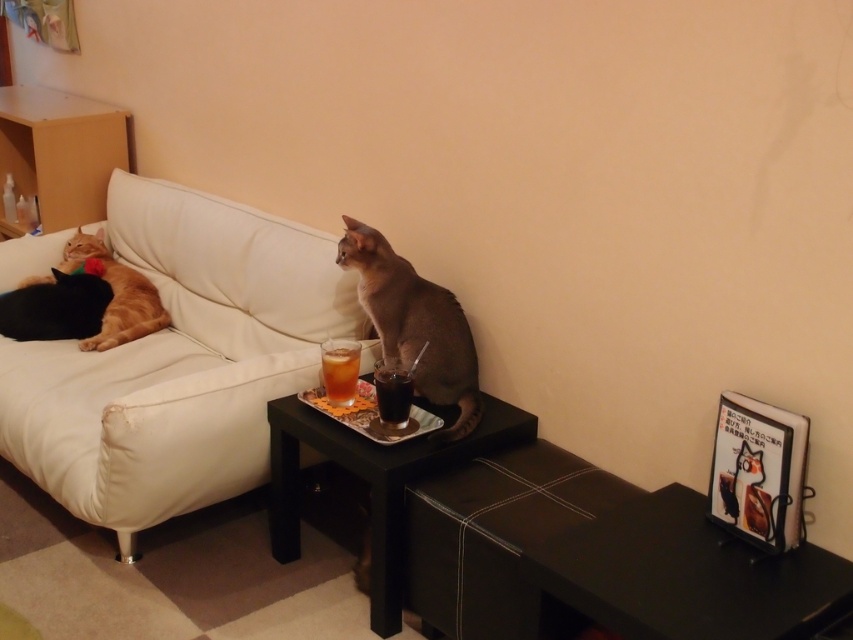
What are the coordinates of the black fur cat at left?

The black fur cat at left is located at coordinates (56, 307).